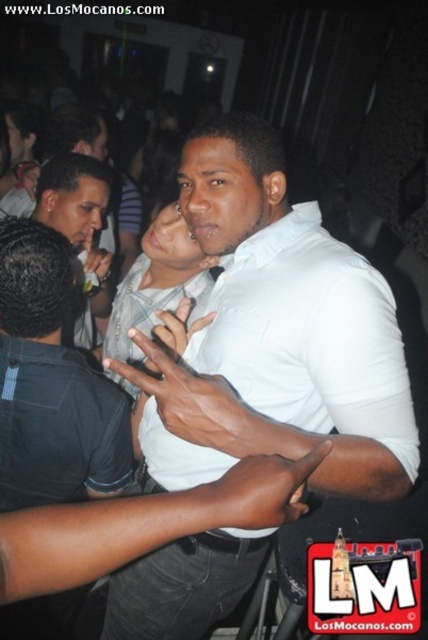
You are a photographer at the nightclub scene. You need to adjust your camera focus to capture both the white matte shirt at center and the matte white shirt at center clearly. Which one should you focus on first to ensure both are in focus?

The white matte shirt at center is taller than the matte white shirt at center, so focusing on the taller one first would help ensure both are in focus as they are positioned at different heights.

You are a photographer trying to capture the perfect shot of the two points in the scene. Which point, point (315, 352) or point (119, 328), would appear larger in your photo?

Point (315, 352) is closer to the camera than point (119, 328), so it would appear larger in the photo.